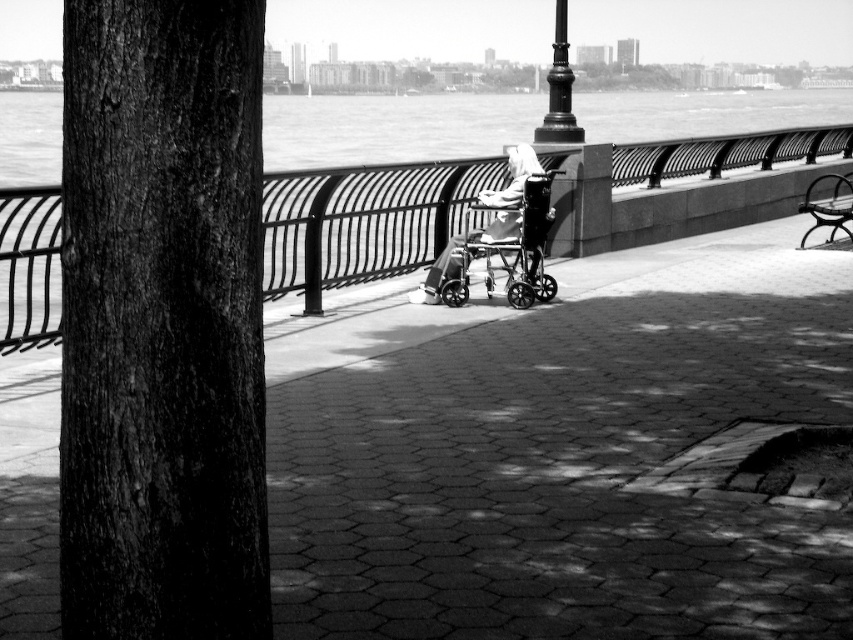
Image resolution: width=853 pixels, height=640 pixels. What do you see at coordinates (560, 88) in the screenshot?
I see `black polished metal pole at center` at bounding box center [560, 88].

Who is lower down, black polished metal pole at center or smooth metal bench at right?

smooth metal bench at right

At what (x,y) coordinates should I click in order to perform the action: click on black polished metal pole at center. Please return your answer as a coordinate pair (x, y). Image resolution: width=853 pixels, height=640 pixels. Looking at the image, I should click on (560, 88).

Where is `black polished metal pole at center`? black polished metal pole at center is located at coordinates (560, 88).

Who is lower down, brick pavement at center or metallic silver walker at center?

Positioned lower is brick pavement at center.

Between brick pavement at center and metallic silver walker at center, which one has less height?

With less height is brick pavement at center.

What do you see at coordinates (558, 452) in the screenshot? The image size is (853, 640). I see `brick pavement at center` at bounding box center [558, 452].

This screenshot has width=853, height=640. I want to click on brick pavement at center, so click(558, 452).

Is brick pavement at center closer to camera compared to smooth metal railing at center?

Yes, it is.

Does brick pavement at center appear under smooth metal railing at center?

Yes, brick pavement at center is below smooth metal railing at center.

Who is more forward, (486, 355) or (12, 342)?

Point (12, 342) is in front.

Where is `brick pavement at center`? The width and height of the screenshot is (853, 640). brick pavement at center is located at coordinates pos(558,452).